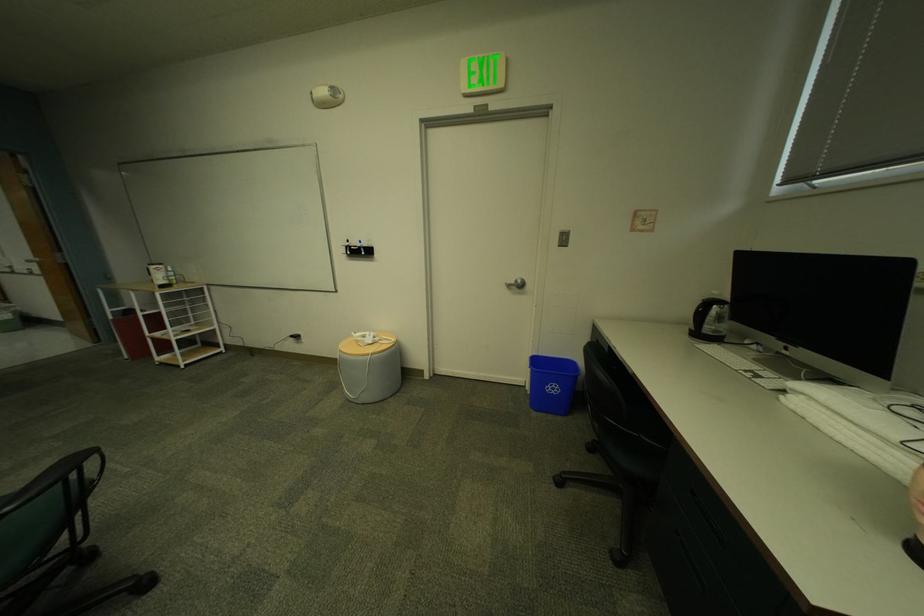
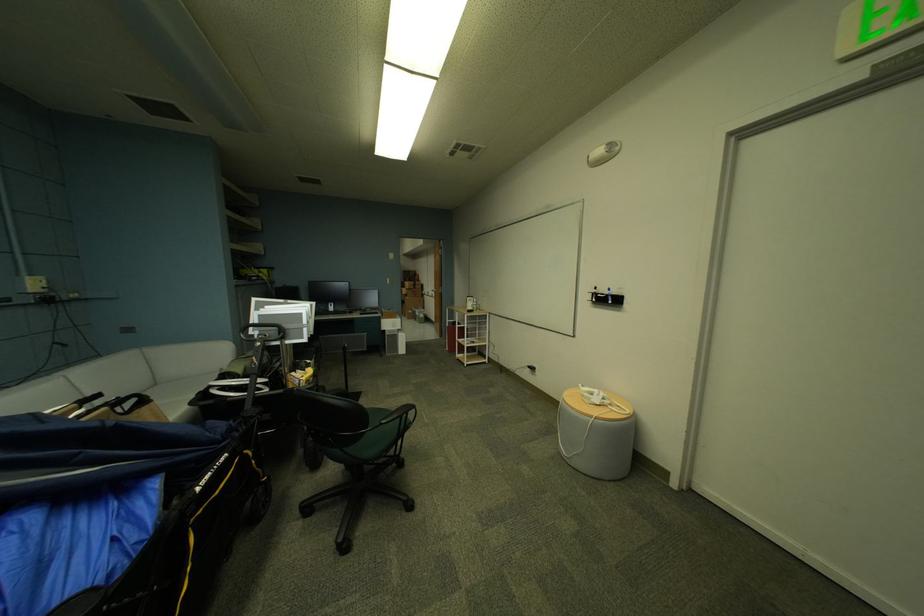
In the second image, find the point that corresponds to (106,342) in the first image.

(450, 337)